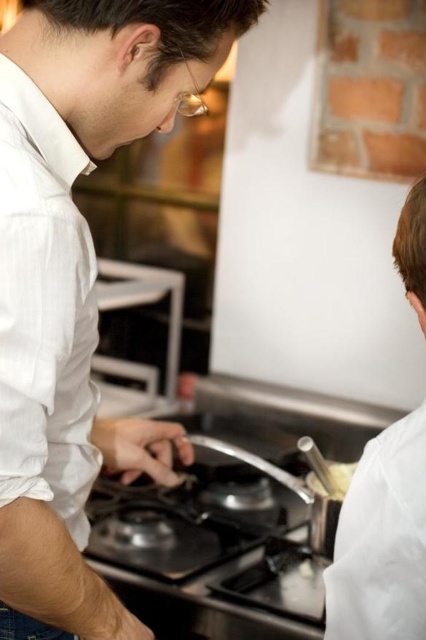
You are a chef in the kitchen. You need to determine which object is shorter between the shiny metallic pot at center and the white matte chef coat at right. Can you identify the shorter one?

The shiny metallic pot at center is shorter than the white matte chef coat at right according to the description.

You are in a kitchen and need to move from the point at coordinates point [71,157] to the point at coordinates point [336,536]. Can you walk directly between these two points without any obstacles?

Point [71,157] is in front of point [336,536], so there might be an obstacle between them. You cannot walk directly between these two points without any obstacles.

You are a delivery robot in a kitchen. You need to deliver a package to the person closest to the camera. The coordinates of the point you should aim for are given as point (123,80). The distance from the camera to this point is 29.99 inches. The two people in the scene are described as follows. The person on the left is actively cooking at the stove, while the person on the right is observing from behind and to the side. Based on their positions, which person is closer to the camera?

The person closest to the camera is the one at point (123,80), which is 29.99 inches away. Since this point is associated with the person on the left actively cooking at the stove, they are the closest to the camera.